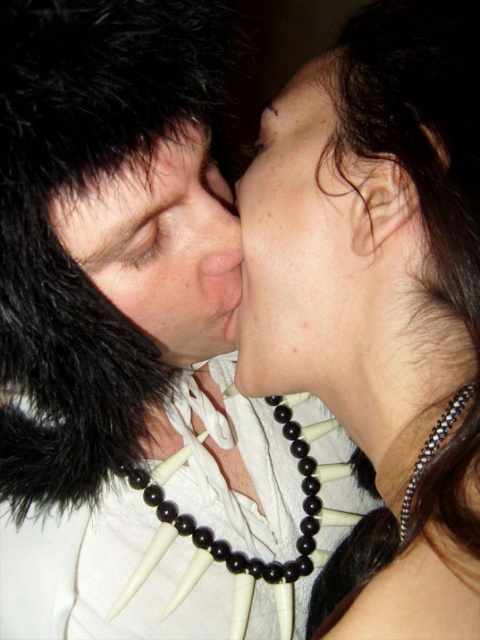
Does point (444, 280) come farther from viewer compared to point (115, 177)?

Yes, point (444, 280) is behind point (115, 177).

Between black beaded necklace at upper center and black fur at upper left, which one has more height?

Standing taller between the two is black beaded necklace at upper center.

Which is behind, point (377, 326) or point (134, 156)?

The point (377, 326) is more distant.

Where is `black beaded necklace at upper center`? Image resolution: width=480 pixels, height=640 pixels. black beaded necklace at upper center is located at coordinates (380, 300).

Does smooth skin face at center have a greater height compared to matte black hair at center?

Correct, smooth skin face at center is much taller as matte black hair at center.

Does smooth skin face at center appear on the right side of matte black hair at center?

Indeed, smooth skin face at center is positioned on the right side of matte black hair at center.

Which is behind, point (312, 168) or point (172, 144)?

The point (312, 168) is more distant.

This screenshot has width=480, height=640. In order to click on smooth skin face at center in this screenshot , I will do `click(304, 248)`.

Who is lower down, matte black hair at center or black fur at upper left?

matte black hair at center

This screenshot has width=480, height=640. Describe the element at coordinates (162, 244) in the screenshot. I see `matte black hair at center` at that location.

Who is more forward, (144, 193) or (75, 196)?

Positioned in front is point (75, 196).

What are the coordinates of `matte black hair at center` in the screenshot? It's located at (162, 244).